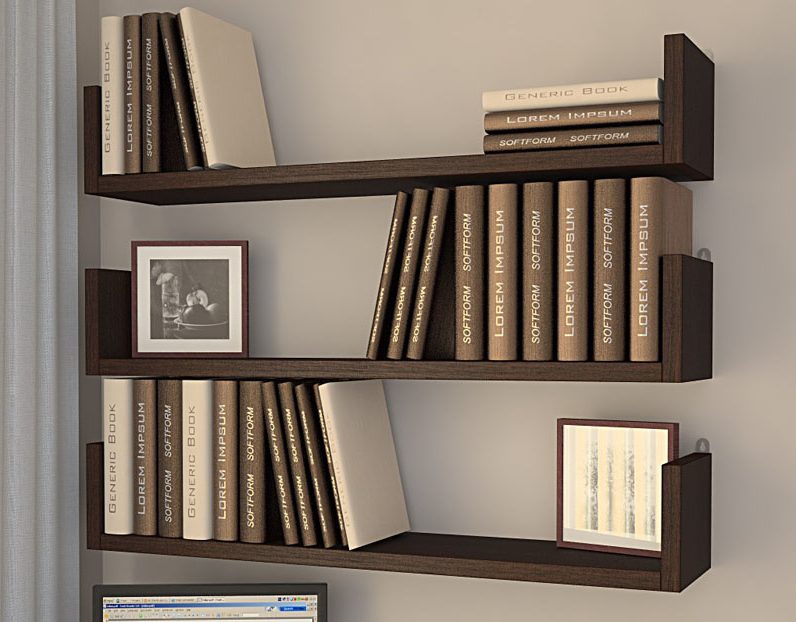
Identify the location of bookend side of shelf. The width and height of the screenshot is (796, 622). (673, 502), (92, 486), (95, 300), (676, 300), (676, 73), (86, 114).